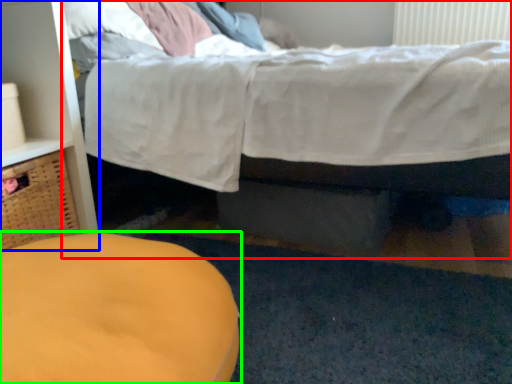
Question: Based on their relative distances, which object is farther from bed (highlighted by a red box)? Choose from dresser (highlighted by a blue box) and furniture (highlighted by a green box).

Choices:
 (A) dresser
 (B) furniture

Answer: (B)